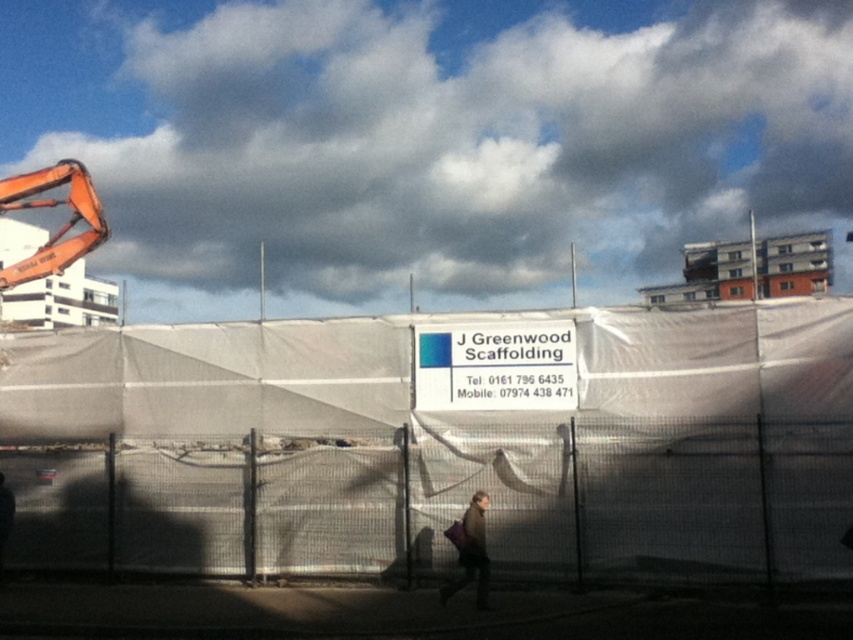
Question: From the image, what is the correct spatial relationship of white plastic sign at center in relation to brown leather jacket at center?

Choices:
 (A) left
 (B) right

Answer: (B)

Question: Estimate the real-world distances between objects in this image. Which object is closer to the white plastic sign at center?

Choices:
 (A) metallic wire mesh fence at center
 (B) brown leather jacket at center

Answer: (A)

Question: Can you confirm if white plastic sign at center is positioned below brown leather jacket at center?

Choices:
 (A) no
 (B) yes

Answer: (A)

Question: Which point is farther to the camera?

Choices:
 (A) brown leather jacket at center
 (B) white plastic sign at center
 (C) metallic wire mesh fence at center

Answer: (B)

Question: Which point appears farthest from the camera in this image?

Choices:
 (A) (289, 556)
 (B) (482, 513)

Answer: (A)

Question: Is white plastic sign at center above brown leather jacket at center?

Choices:
 (A) no
 (B) yes

Answer: (B)